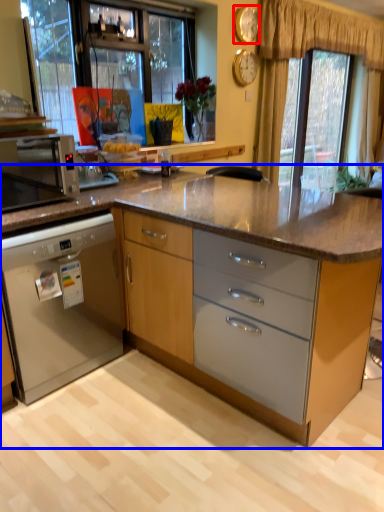
Question: Among these objects, which one is farthest to the camera, clock (highlighted by a red box) or cabinetry (highlighted by a blue box)?

Choices:
 (A) clock
 (B) cabinetry

Answer: (A)